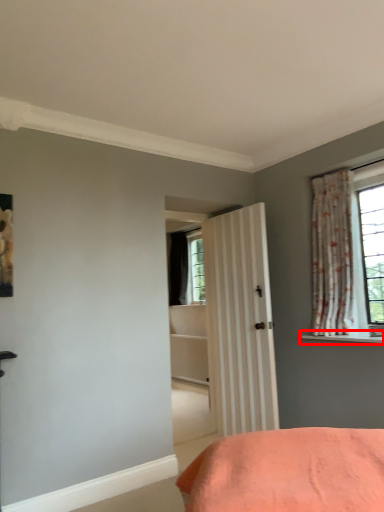
Question: From the image's perspective, what is the correct spatial relationship of window sill (annotated by the red box) in relation to curtain?

Choices:
 (A) above
 (B) below

Answer: (B)